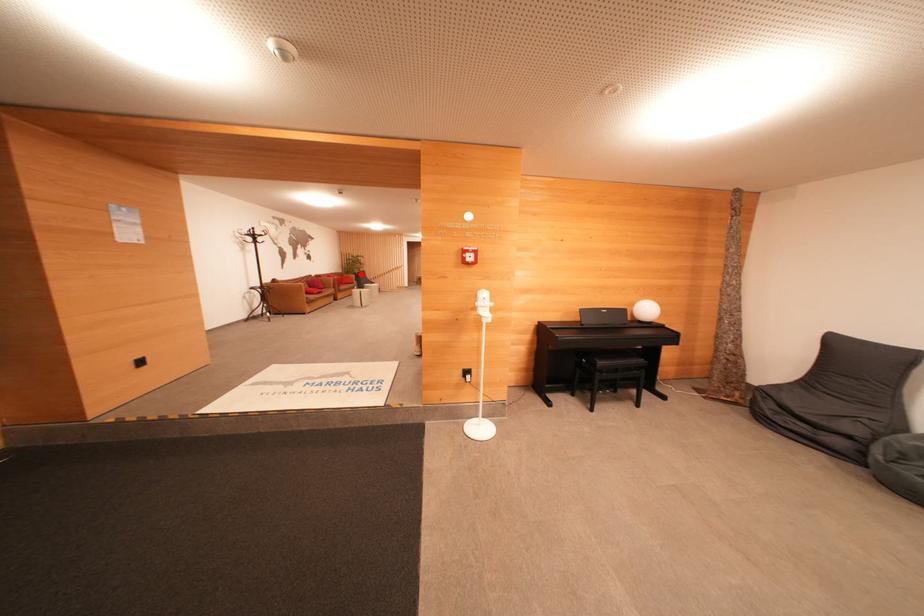
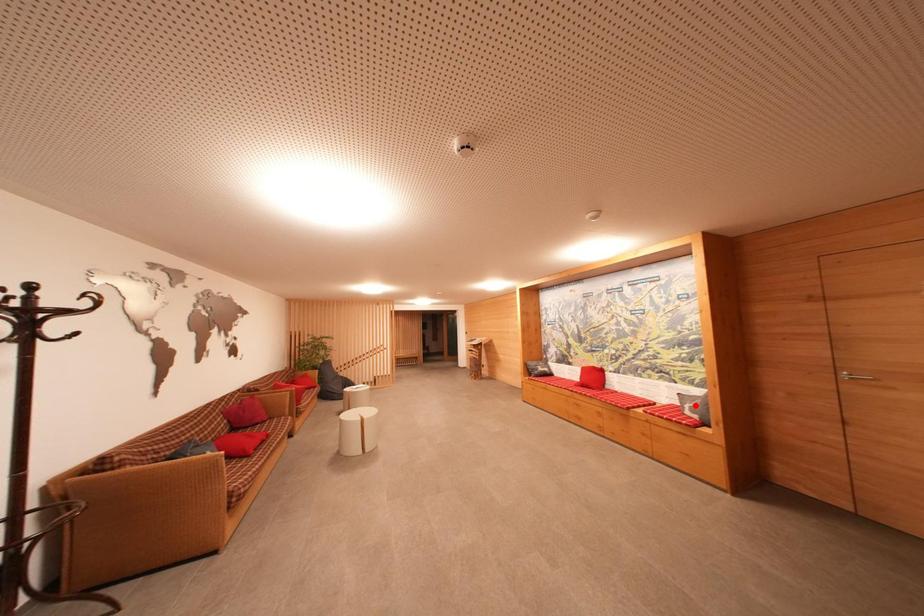
I am providing you with two images of the same scene from different viewpoints. A red point is marked on the first image and another point is marked on the second image. Do the highlighted points in image1 and image2 indicate the same real-world spot?

No